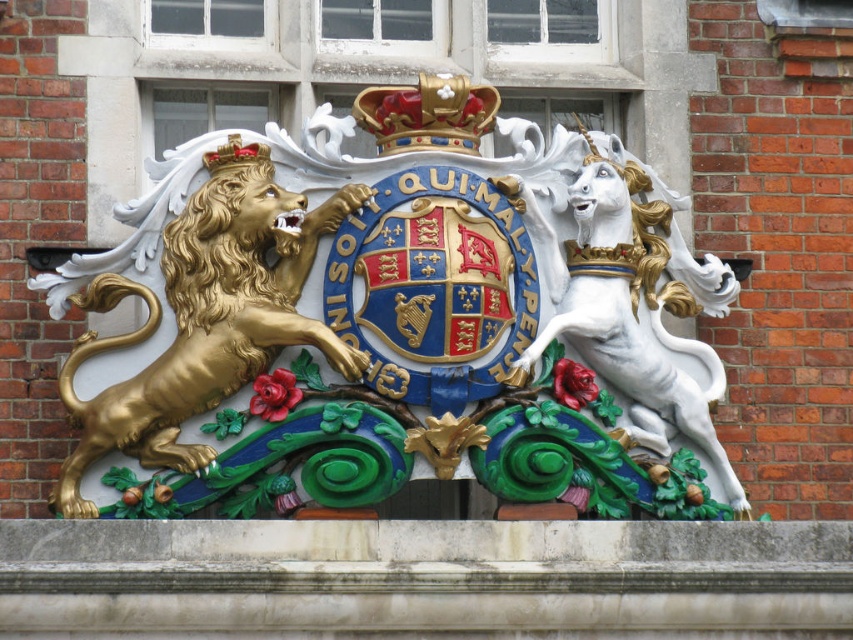
Who is shorter, gold metallic lion at center or gold metallic crown at upper center?

With less height is gold metallic crown at upper center.

Which is below, gold metallic lion at center or gold metallic crown at upper center?

Positioned lower is gold metallic lion at center.

Which is in front, point (410, 321) or point (231, 148)?

Positioned in front is point (410, 321).

Locate an element on the screen. This screenshot has height=640, width=853. gold metallic lion at center is located at coordinates (396, 332).

Is gold metallic lion at center to the left of white glossy unicorn at right from the viewer's perspective?

Yes, gold metallic lion at center is to the left of white glossy unicorn at right.

What do you see at coordinates (396, 332) in the screenshot? The width and height of the screenshot is (853, 640). I see `gold metallic lion at center` at bounding box center [396, 332].

Locate an element on the screen. The width and height of the screenshot is (853, 640). gold metallic lion at center is located at coordinates (396, 332).

Who is higher up, gold polished lion at left or gold jeweled crown at center?

gold jeweled crown at center is above.

Based on the photo, is gold polished lion at left thinner than gold jeweled crown at center?

Yes, gold polished lion at left is thinner than gold jeweled crown at center.

Who is more distant from viewer, [184,275] or [387,147]?

The point [387,147] is more distant.

Where is `gold polished lion at left`? This screenshot has width=853, height=640. gold polished lion at left is located at coordinates (204, 323).